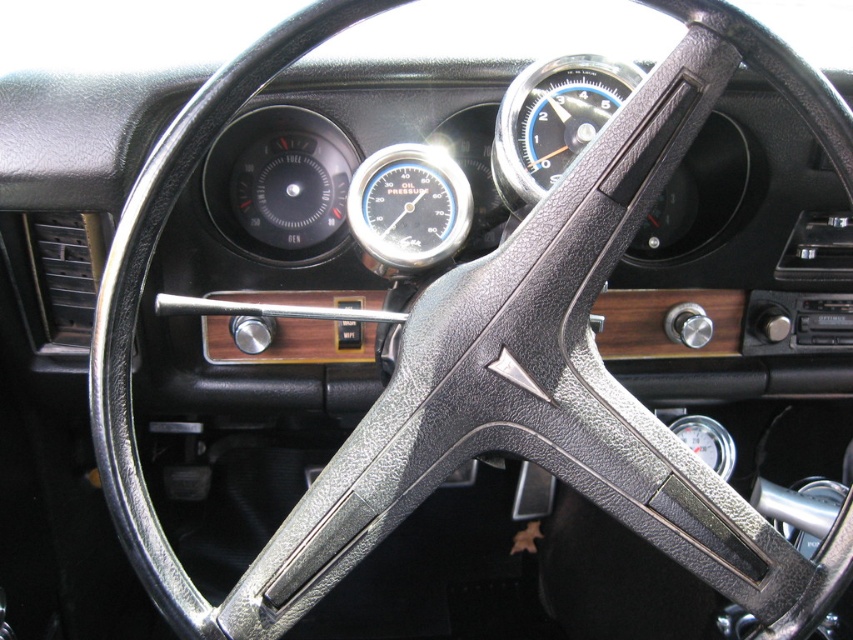
You are designing a dashboard layout and need to know the relative widths of the blue leather speedometer at upper center and the matte black gauge at center. Which one is wider?

The blue leather speedometer at upper center is wider than the matte black gauge at center according to the description.